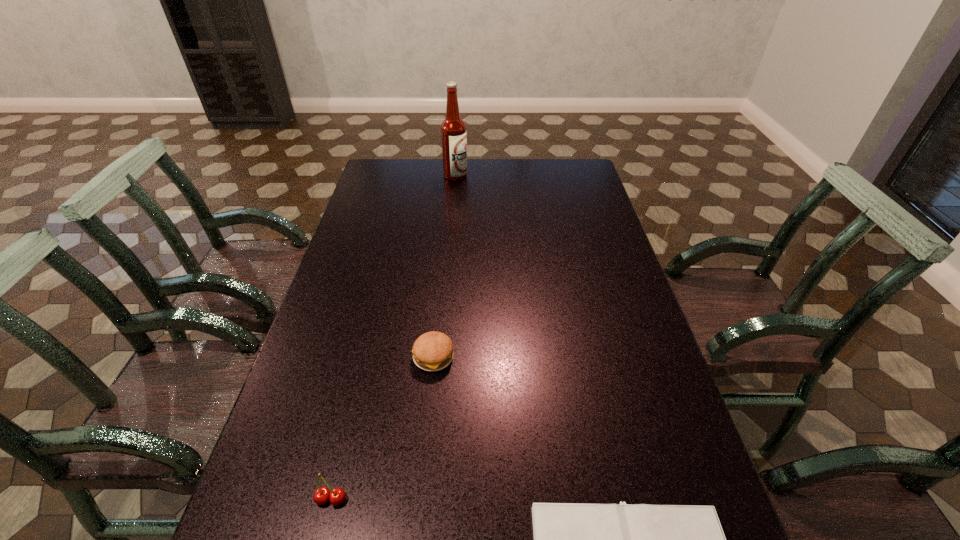
Where is `alcohol`? alcohol is located at coordinates (453, 129).

This screenshot has width=960, height=540. What are the coordinates of `the tallest object` in the screenshot? It's located at (453, 129).

At what (x,y) coordinates should I click in order to perform the action: click on the second tallest object. Please return your answer as a coordinate pair (x, y). Looking at the image, I should click on (321, 496).

In order to click on the leftmost object in this screenshot , I will do `click(321, 496)`.

The width and height of the screenshot is (960, 540). I want to click on the third nearest object, so click(433, 351).

Locate an element on the screen. The width and height of the screenshot is (960, 540). hamburger is located at coordinates (433, 351).

The image size is (960, 540). What are the coordinates of `vacant region located 0.220m on the label side of the tallest object` in the screenshot? It's located at (521, 176).

Where is `vacant space located 0.160m on the back of the third nearest object`? The height and width of the screenshot is (540, 960). vacant space located 0.160m on the back of the third nearest object is located at coordinates pos(439,299).

Image resolution: width=960 pixels, height=540 pixels. I want to click on object that is at the far edge, so click(453, 129).

Identify the location of object that is positioned at the left edge. The height and width of the screenshot is (540, 960). (321, 496).